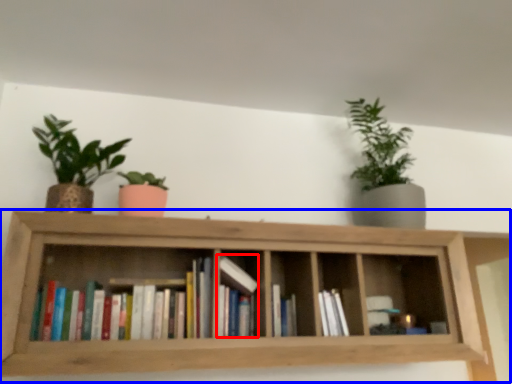
Question: Which point is closer to the camera, book (highlighted by a red box) or shelf (highlighted by a blue box)?

Choices:
 (A) book
 (B) shelf

Answer: (B)